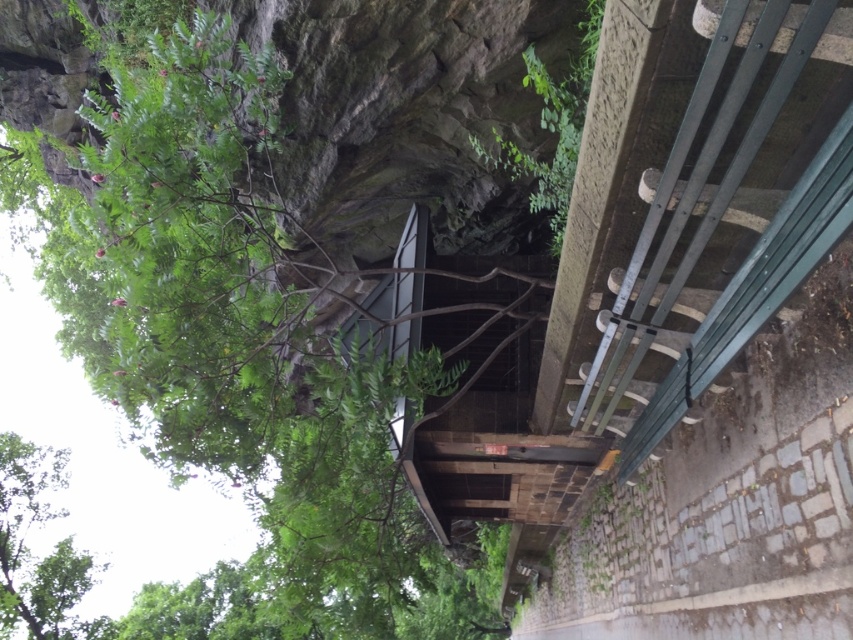
Question: Which point is closer to the camera taking this photo?

Choices:
 (A) (38, 456)
 (B) (225, 384)

Answer: (B)

Question: Is green leafy tree at upper left thinner than green leafy tree at lower left?

Choices:
 (A) no
 (B) yes

Answer: (A)

Question: Among these points, which one is farthest from the camera?

Choices:
 (A) (62, 195)
 (B) (0, 451)

Answer: (B)

Question: Which point appears closest to the camera in this image?

Choices:
 (A) (230, 330)
 (B) (32, 518)

Answer: (A)

Question: Is green leafy tree at upper left to the right of green leafy tree at lower left from the viewer's perspective?

Choices:
 (A) yes
 (B) no

Answer: (A)

Question: Is green leafy tree at upper left in front of green leafy tree at lower left?

Choices:
 (A) yes
 (B) no

Answer: (A)